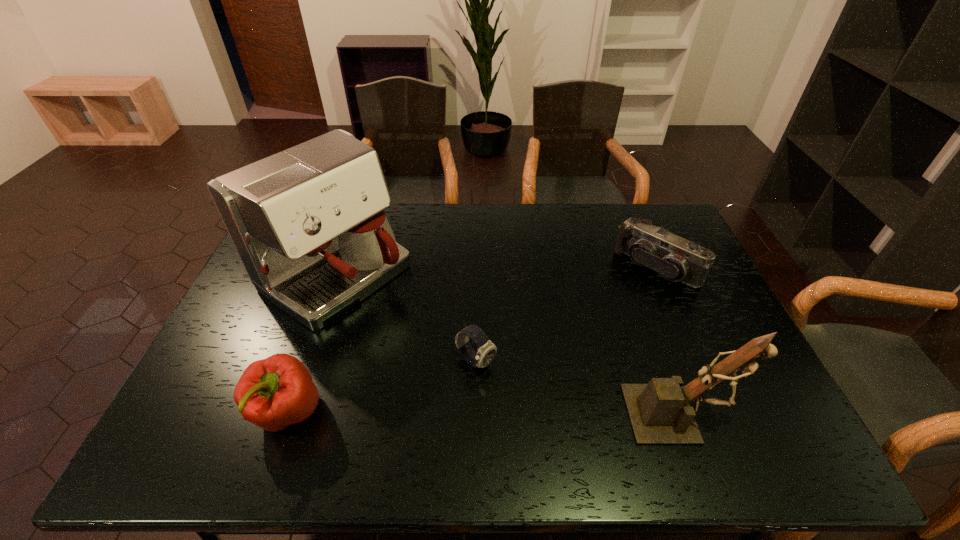
Locate an element on the screen. The width and height of the screenshot is (960, 540). bell pepper is located at coordinates (273, 393).

You are a GUI agent. You are given a task and a screenshot of the screen. Output one action in this format:
    pyautogui.click(x=<x>, y=<y>)
    Task: Click on the figurine
    The image size is (960, 540).
    Given the screenshot: What is the action you would take?
    pyautogui.click(x=659, y=412)

This screenshot has height=540, width=960. Identify the location of camcorder. (675, 258).

This screenshot has width=960, height=540. Find the location of `the tallest object`. the tallest object is located at coordinates (308, 224).

At what (x,y) coordinates should I click in order to perform the action: click on the third object from left to right. Please return your answer as a coordinate pair (x, y). Looking at the image, I should click on (487, 350).

Find the location of a particular element. Image resolution: width=960 pixels, height=540 pixels. watch is located at coordinates point(487,350).

Find the location of a particular element. The height and width of the screenshot is (540, 960). free space located 0.050m on the right of the bell pepper is located at coordinates pyautogui.click(x=345, y=413).

Image resolution: width=960 pixels, height=540 pixels. I want to click on free location located 0.120m on the front-facing side of the second tallest object, so click(781, 414).

The image size is (960, 540). What are the coordinates of `blank space located on the front-facing side of the camcorder` in the screenshot? It's located at (603, 318).

Identify the location of free space located 0.240m on the front-facing side of the camcorder. The height and width of the screenshot is (540, 960). (593, 327).